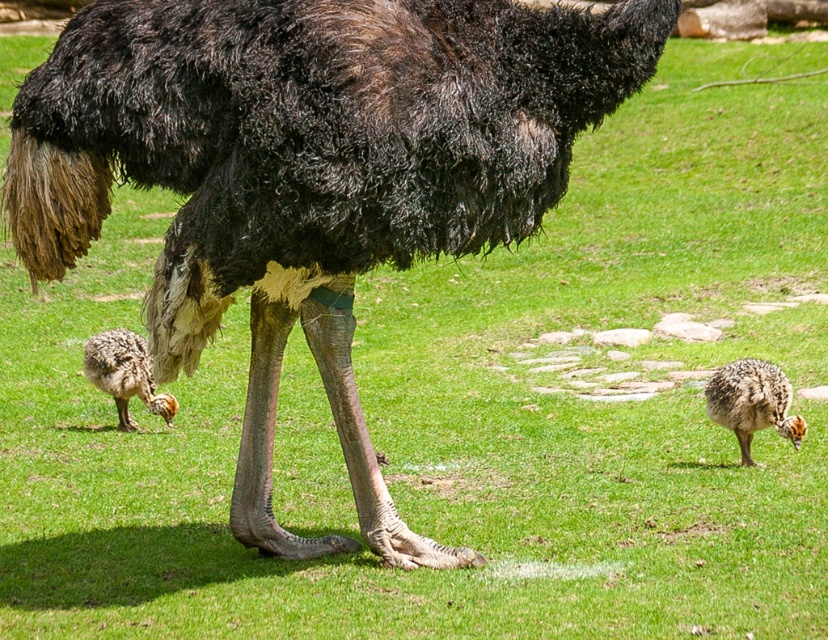
You are standing in the grassy area where the ostrich and chicks are. There is a point marked at coordinates (604, 67). If you want to place a small snack for the ostrich, would you need to walk towards or away from the point to reach the ostrich?

The point at (604, 67) is 5.54 meters away from the viewer. Since the ostrich is in the foreground, closer to the viewer than the background where the chicks are, you would need to walk towards the point to reach the ostrich.

You are a wildlife photographer trying to capture a photo of the black feathered ostrich at center and the speckled feathered chick at lower left. Based on their sizes, which animal should you focus on first to ensure they both fit in the frame?

The black feathered ostrich at center is wider than the speckled feathered chick at lower left, so you should focus on the black feathered ostrich at center first to ensure both fit in the frame.